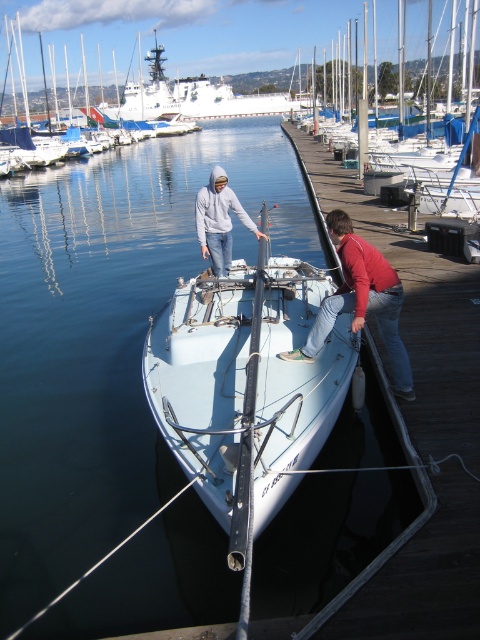
You are a delivery person carrying a box that is 4 feet long. You need to place it between the white matte sailboat at center and the red cotton shirt at center. Is there enough space for the box?

The white matte sailboat at center is 3.66 feet from the red cotton shirt at center. Since the box is 4 feet long, it won not fit between them as the distance is shorter than the box.

From the picture: You are a dock worker who needs to load a cargo container onto the white matte sailboat at center and the white glossy sailboat at upper center. Which boat should you choose if the container requires a wider deck to fit properly?

The white glossy sailboat at upper center has a wider deck than the white matte sailboat at center, so you should choose the white glossy sailboat at upper center to load the cargo container.